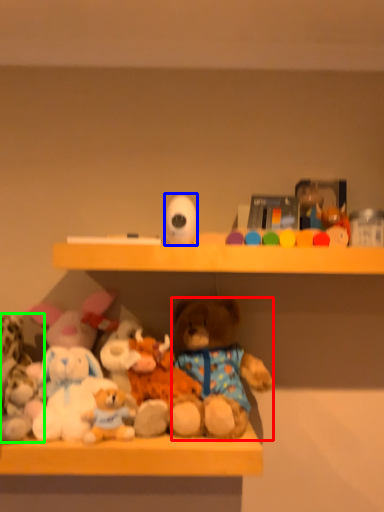
Question: Which object is positioned farthest from teddy bear (highlighted by a red box)? Select from toy (highlighted by a blue box) and toy (highlighted by a green box).

Choices:
 (A) toy
 (B) toy

Answer: (B)